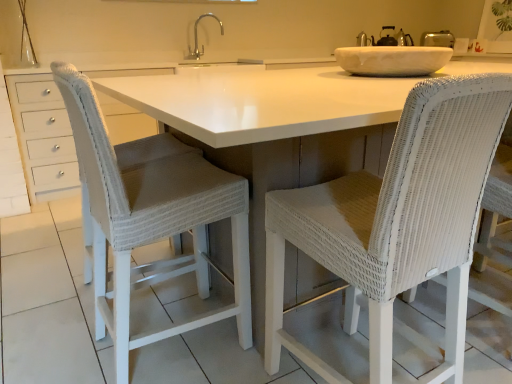
Question: Is point (246, 291) closer or farther from the camera than point (215, 18)?

Choices:
 (A) closer
 (B) farther

Answer: (A)

Question: Choose the correct answer: Is white wicker chair at center, placed as the 1th chair when sorted from left to right, inside silver metallic faucet at upper center or outside it?

Choices:
 (A) outside
 (B) inside

Answer: (A)

Question: Considering the real-world distances, which object is farthest from the white wicker chair at center, the first chair in the right-to-left sequence?

Choices:
 (A) silver metallic faucet at upper center
 (B) white wicker chair at center, which is the 2th chair from right to left

Answer: (A)

Question: Which object is positioned closest to the silver metallic faucet at upper center?

Choices:
 (A) white wicker chair at center, which is the 2th chair from right to left
 (B) white wicker chair at center, the first chair in the right-to-left sequence

Answer: (A)